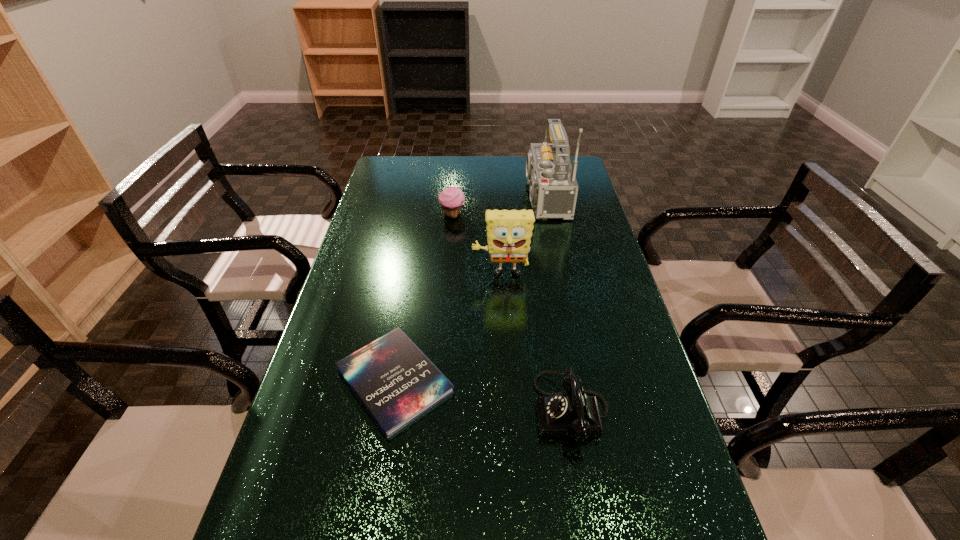
At what (x,y) coordinates should I click in order to perform the action: click on free space at the far edge of the desktop. Please return your answer as a coordinate pair (x, y). Looking at the image, I should click on (501, 168).

The image size is (960, 540). Find the location of `vacant space at the left edge`. vacant space at the left edge is located at coordinates (377, 276).

You are a GUI agent. You are given a task and a screenshot of the screen. Output one action in this format:
    pyautogui.click(x=<x>, y=<y>)
    Task: Click on the free space at the right edge of the desktop
    
    Given the screenshot: What is the action you would take?
    pyautogui.click(x=610, y=337)

What are the coordinates of `free space between the hardback book and the cupcake` in the screenshot? It's located at (423, 298).

At what (x,y) coordinates should I click in order to perform the action: click on free space between the shortest object and the radio receiver. Please return your answer as a coordinate pair (x, y). This screenshot has width=960, height=540. Looking at the image, I should click on (468, 288).

This screenshot has width=960, height=540. What are the coordinates of `free space between the shortest object and the cupcake` in the screenshot? It's located at (423, 298).

At what (x,y) coordinates should I click in order to perform the action: click on free space that is in between the telephone and the cupcake. Please return your answer as a coordinate pair (x, y). Image resolution: width=960 pixels, height=540 pixels. Looking at the image, I should click on click(x=513, y=313).

Image resolution: width=960 pixels, height=540 pixels. I want to click on object that can be found as the fourth closest to the cupcake, so click(x=572, y=413).

Locate an element on the screen. object that stands as the fourth closest to the radio receiver is located at coordinates (572, 413).